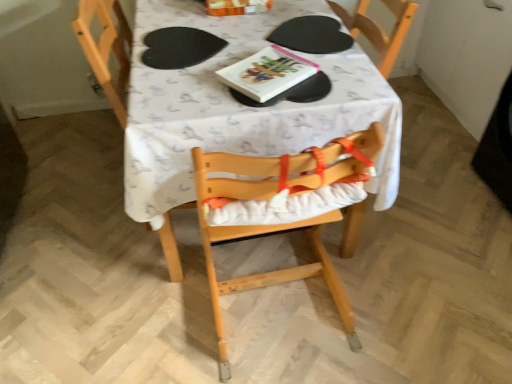
At what (x,y) coordinates should I click in order to perform the action: click on vacant space to the left of black matte paper plate at center. Please return your answer as a coordinate pair (x, y). Image resolution: width=512 pixels, height=384 pixels. Looking at the image, I should click on (241, 36).